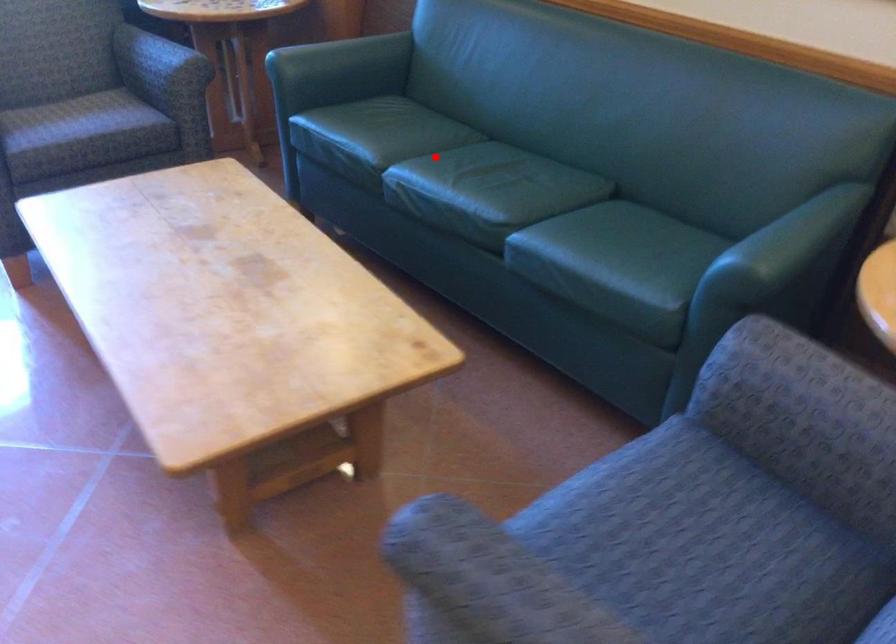
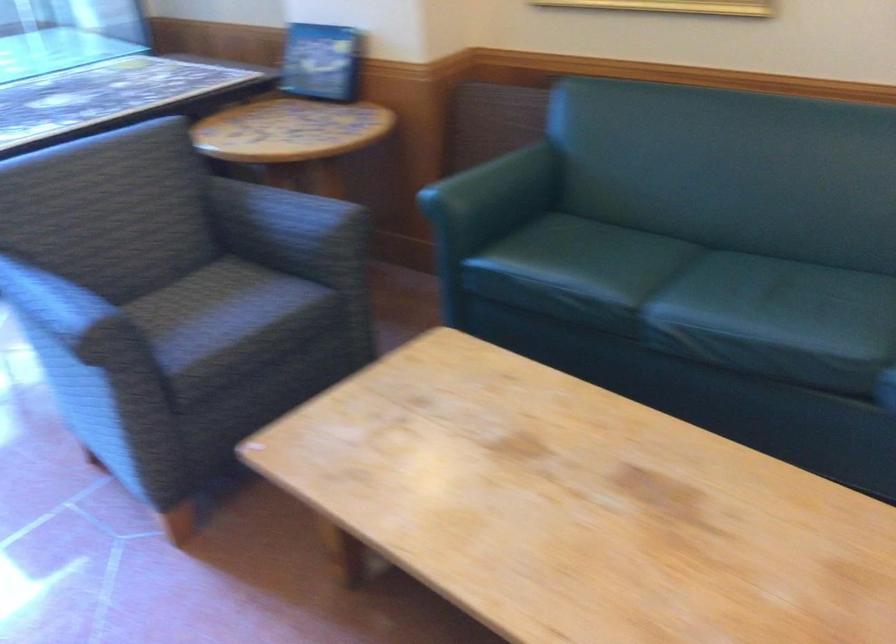
Question: I am providing you with two images of the same scene from different viewpoints. Image1 has a red point marked. In image2, the corresponding 3D location appears at what relative position? Reply with the corresponding letter.

Choices:
 (A) Closer
 (B) Farther

Answer: (A)